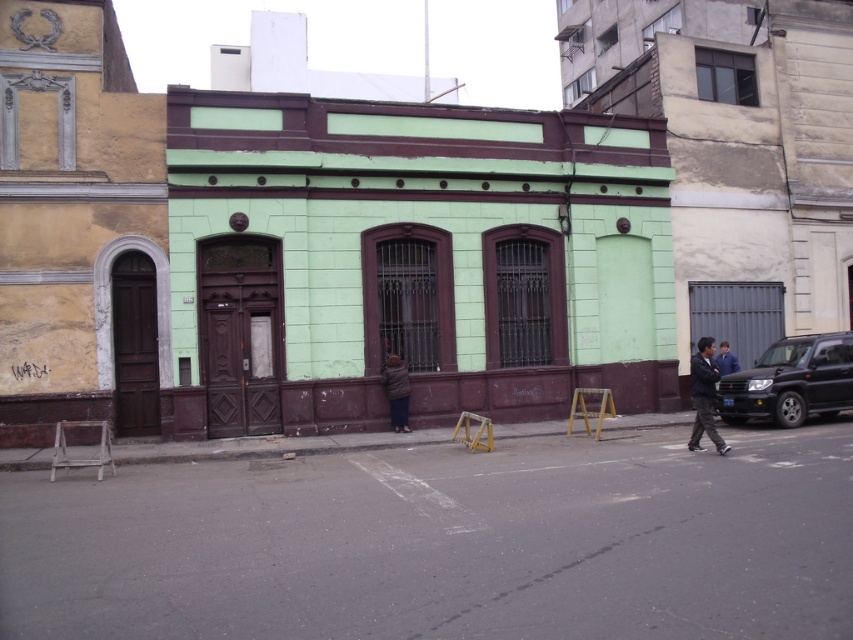
Based on the photo, which is below, dark blue jacket at lower right or brown fuzzy coat at center?

dark blue jacket at lower right is below.

Locate an element on the screen. dark blue jacket at lower right is located at coordinates pyautogui.click(x=704, y=396).

Who is more distant from viewer, (x=697, y=426) or (x=397, y=388)?

The point (x=397, y=388) is behind.

Locate an element on the screen. The height and width of the screenshot is (640, 853). dark blue jacket at lower right is located at coordinates (704, 396).

Can you confirm if black matte suv at right is shorter than dark blue jacket at lower right?

No, black matte suv at right is not shorter than dark blue jacket at lower right.

Can you confirm if black matte suv at right is smaller than dark blue jacket at lower right?

Actually, black matte suv at right might be larger than dark blue jacket at lower right.

Does point (753, 369) lie behind point (709, 436)?

That is True.

Where is `black matte suv at right`? The height and width of the screenshot is (640, 853). black matte suv at right is located at coordinates (791, 381).

Is brown fuzzy coat at center thinner than blue denim jacket at lower right?

Correct, brown fuzzy coat at center's width is less than blue denim jacket at lower right's.

Who is more distant from viewer, (397, 365) or (718, 356)?

Point (718, 356)

The image size is (853, 640). Identify the location of brown fuzzy coat at center. (396, 392).